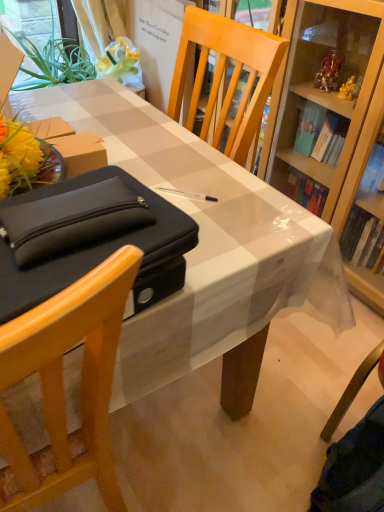
Question: Considering the positions of black fabric pouch at left and white glossy desk at center in the image, is black fabric pouch at left wider or thinner than white glossy desk at center?

Choices:
 (A) thin
 (B) wide

Answer: (A)

Question: From the image's perspective, is black fabric pouch at left above or below white glossy desk at center?

Choices:
 (A) above
 (B) below

Answer: (B)

Question: Considering the real-world distances, which object is closest to the white glossy desk at center?

Choices:
 (A) black fabric pouch at left
 (B) matte black bag at left

Answer: (A)

Question: Based on their relative distances, which object is nearer to the black fabric pouch at left?

Choices:
 (A) matte black bag at left
 (B) white glossy desk at center

Answer: (A)